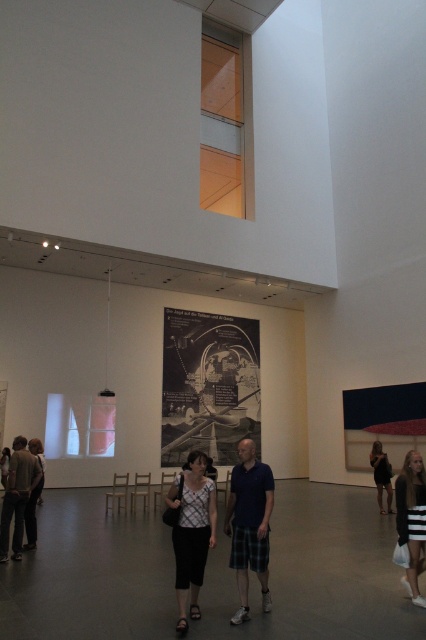
Question: Can you confirm if striped cotton dress at lower right is smaller than dark gray sweater at lower right?

Choices:
 (A) yes
 (B) no

Answer: (A)

Question: Among these points, which one is farthest from the camera?

Choices:
 (A) pos(388,483)
 (B) pos(419,538)
 (C) pos(206,493)
 (D) pos(244,451)

Answer: (A)

Question: From the image, what is the correct spatial relationship of white printed blouse at center in relation to matte gray pants at lower left?

Choices:
 (A) above
 (B) below

Answer: (A)

Question: From the image, what is the correct spatial relationship of matte blue shirt at center in relation to striped cotton dress at lower right?

Choices:
 (A) above
 (B) below

Answer: (A)

Question: Which object is farther from the camera taking this photo?

Choices:
 (A) matte gray pants at lower left
 (B) white printed blouse at center
 (C) dark gray sweater at lower right

Answer: (C)

Question: Which is nearer to the matte blue shirt at center?

Choices:
 (A) white printed blouse at center
 (B) matte gray pants at lower left
 (C) dark gray sweater at lower right
 (D) striped cotton dress at lower right

Answer: (A)